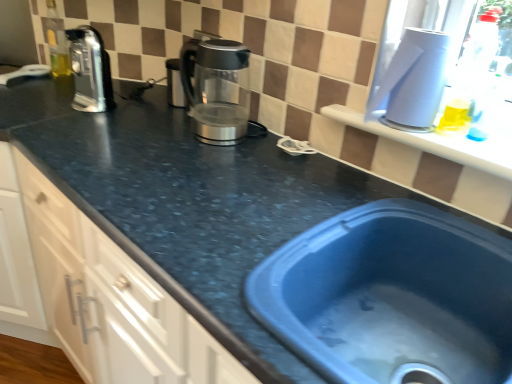
Question: From a real-world perspective, is satin silver kettle at center, the 1th appliance viewed from the left, below sleek metallic kettle at center?

Choices:
 (A) yes
 (B) no

Answer: (A)

Question: From the image's perspective, is satin silver kettle at center, which appears as the second appliance when viewed from the front, below sleek metallic kettle at center?

Choices:
 (A) yes
 (B) no

Answer: (B)

Question: From the image's perspective, is satin silver kettle at center, placed as the 1th appliance when sorted from back to front, on sleek metallic kettle at center?

Choices:
 (A) yes
 (B) no

Answer: (A)

Question: Is the depth of satin silver kettle at center, placed as the 1th appliance when sorted from back to front, less than that of sleek metallic kettle at center?

Choices:
 (A) yes
 (B) no

Answer: (B)

Question: From a real-world perspective, does satin silver kettle at center, which appears as the second appliance when viewed from the front, stand above sleek metallic kettle at center?

Choices:
 (A) no
 (B) yes

Answer: (A)

Question: Is sleek metallic kettle at center at the back of satin silver kettle at center, which appears as the second appliance when viewed from the front?

Choices:
 (A) no
 (B) yes

Answer: (A)

Question: Is blue plastic sink at lower right completely or partially outside of white plastic container at upper right, marked as the second appliance in a back-to-front arrangement?

Choices:
 (A) no
 (B) yes

Answer: (B)

Question: From a real-world perspective, is blue plastic sink at lower right positioned over white plastic container at upper right, placed as the 1th appliance when sorted from right to left, based on gravity?

Choices:
 (A) yes
 (B) no

Answer: (B)

Question: Is blue plastic sink at lower right looking in the opposite direction of white plastic container at upper right, placed as the 1th appliance when sorted from right to left?

Choices:
 (A) yes
 (B) no

Answer: (B)

Question: Considering the relative sizes of blue plastic sink at lower right and white plastic container at upper right, acting as the second appliance starting from the left, in the image provided, is blue plastic sink at lower right shorter than white plastic container at upper right, acting as the second appliance starting from the left,?

Choices:
 (A) no
 (B) yes

Answer: (B)

Question: Does blue plastic sink at lower right have a smaller size compared to white plastic container at upper right, acting as the second appliance starting from the left?

Choices:
 (A) no
 (B) yes

Answer: (A)

Question: Does blue plastic sink at lower right contain white plastic container at upper right, acting as the second appliance starting from the left?

Choices:
 (A) yes
 (B) no

Answer: (B)

Question: Is satin silver kettle at center, which appears as the second appliance when viewed from the front, next to matte black countertop at left and touching it?

Choices:
 (A) yes
 (B) no

Answer: (B)